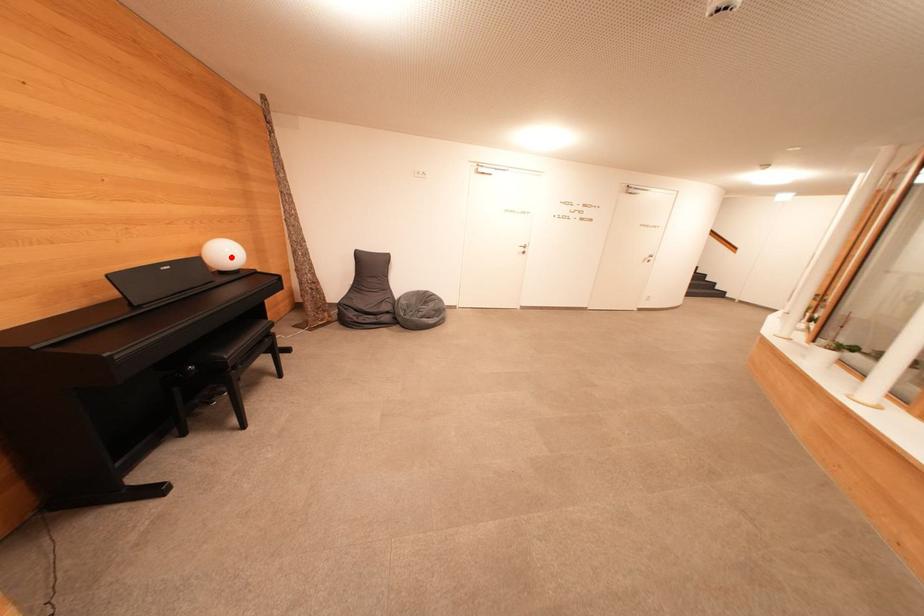
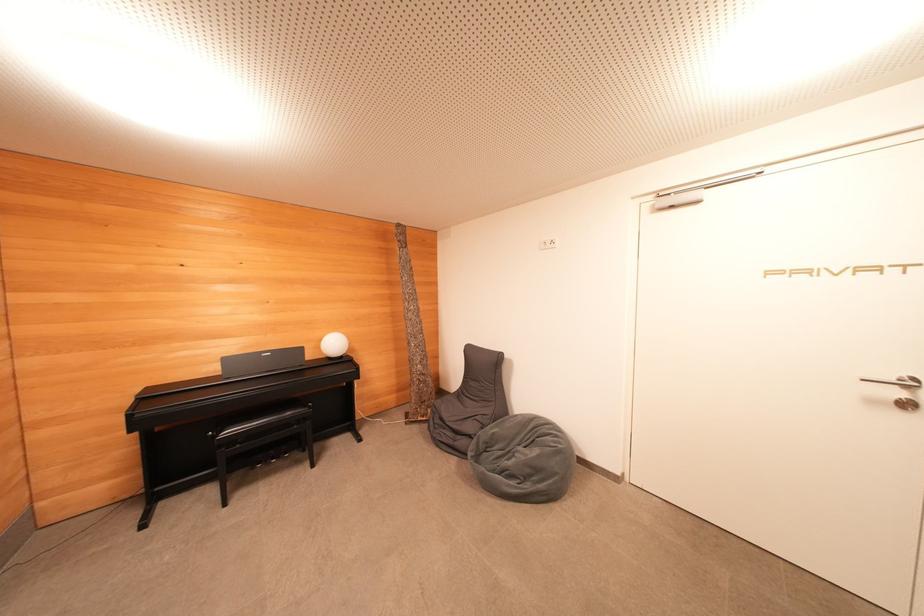
The point at the highlighted location is marked in the first image. Where is the corresponding point in the second image?

(337, 347)